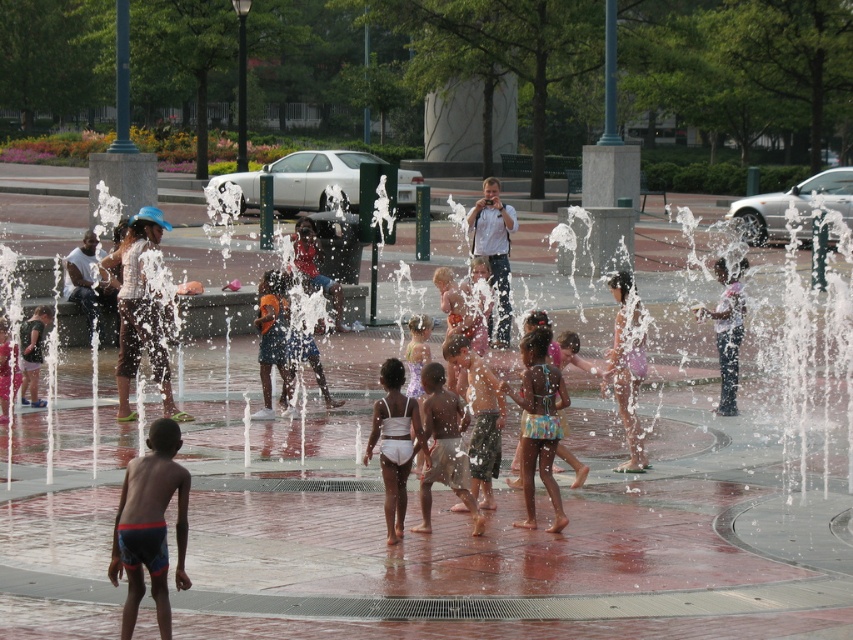
You are standing at the point marked by the coordinates point (625, 369) in the image. What object is located exactly at that point?

The point (625, 369) indicates the purple fabric dress at center.

You are a photographer trying to capture a candid shot of the brown cotton shorts at center and the white cotton shirt at center. Since you want to focus on the lower body, which object should you adjust your camera angle to prioritize?

The brown cotton shorts at center has a lesser height compared to white cotton shirt at center, so you should prioritize focusing on the brown cotton shorts at center to ensure the lower body is properly captured.

You are a photographer standing at the edge of the fountain area. You want to capture a photo that includes both the brown cotton shorts at center and the white cotton shirt at center. Based on their positions, which one should you focus on first if you want to ensure both are in the frame?

The brown cotton shorts at center is below the white cotton shirt at center, so you should focus on the white cotton shirt at center first to ensure both are in the frame.